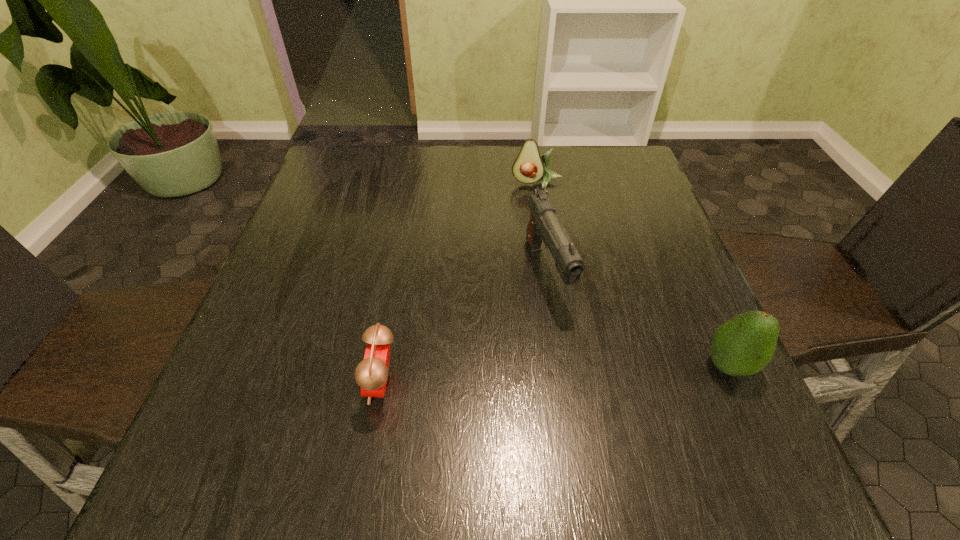
This screenshot has width=960, height=540. Identify the location of object that is at the near right corner. (743, 345).

Identify the location of free space at the far edge. This screenshot has height=540, width=960. (558, 157).

You are a GUI agent. You are given a task and a screenshot of the screen. Output one action in this format:
    pyautogui.click(x=<x>, y=<y>)
    Task: Click on the vacant point at the near edge
    The width and height of the screenshot is (960, 540).
    Given the screenshot: What is the action you would take?
    pyautogui.click(x=579, y=386)

Find the location of a particular element. This screenshot has width=960, height=540. vacant region at the left edge is located at coordinates (341, 268).

Locate an element on the screen. This screenshot has height=540, width=960. vacant space at the right edge is located at coordinates tap(675, 361).

In the image, there is a desktop. At what (x,y) coordinates should I click in order to perform the action: click on vacant space at the far left corner. Please return your answer as a coordinate pair (x, y). Looking at the image, I should click on (348, 181).

This screenshot has width=960, height=540. I want to click on free space at the far right corner of the desktop, so click(x=615, y=157).

Identify the location of free space at the near right corner. This screenshot has width=960, height=540. [706, 398].

Locate an element on the screen. This screenshot has height=540, width=960. empty location between the gun and the right avocado is located at coordinates (637, 319).

The height and width of the screenshot is (540, 960). I want to click on free spot between the nearer avocado and the farther avocado, so click(x=633, y=275).